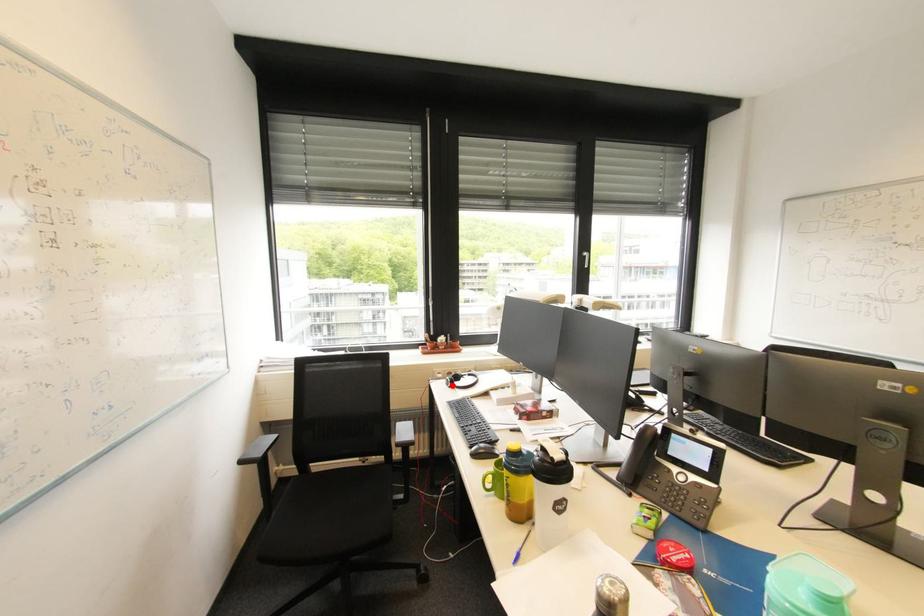
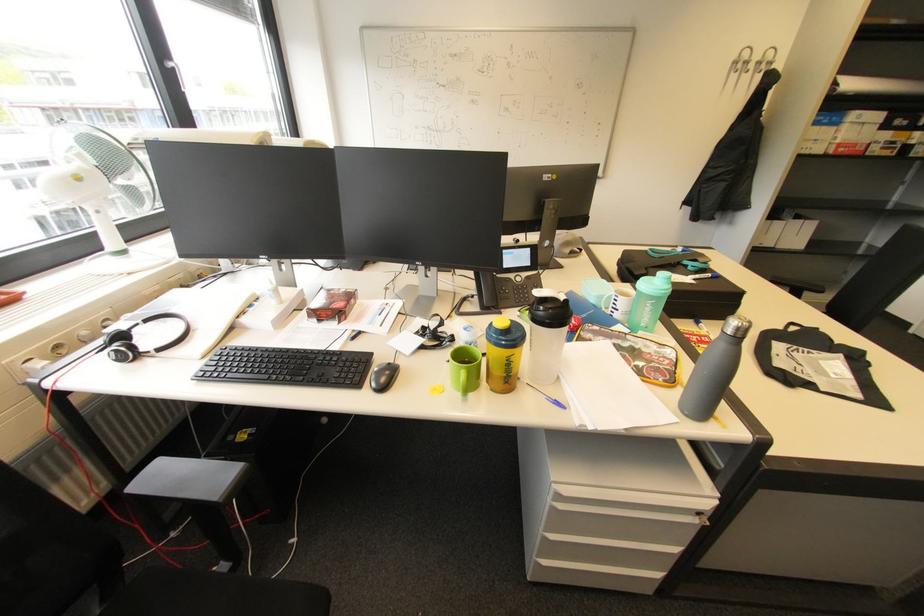
In the second image, find the point that corresponds to the highlighted location in the first image.

(127, 361)